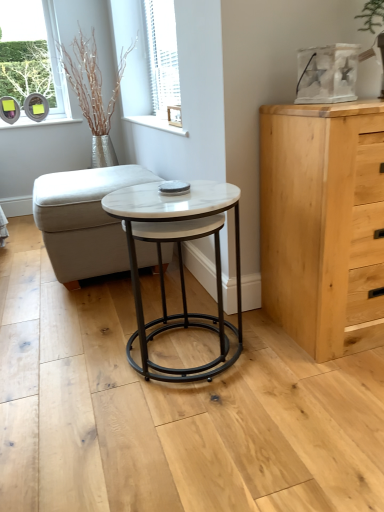
Where is `vacant space situated above white marble coffee table at center (from a real-world perspective)`? This screenshot has height=512, width=384. vacant space situated above white marble coffee table at center (from a real-world perspective) is located at coordinates (163, 200).